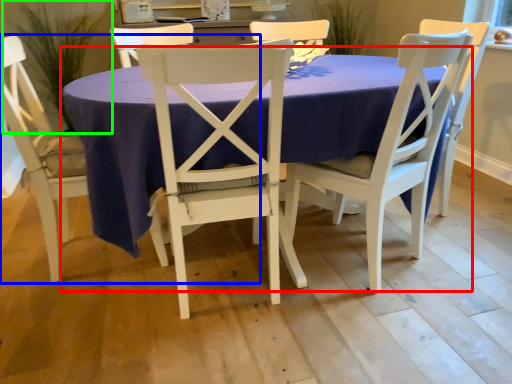
Question: Estimate the real-world distances between objects in this image. Which object is closer to kitchen & dining room table (highlighted by a red box), chair (highlighted by a blue box) or plant (highlighted by a green box)?

Choices:
 (A) chair
 (B) plant

Answer: (A)